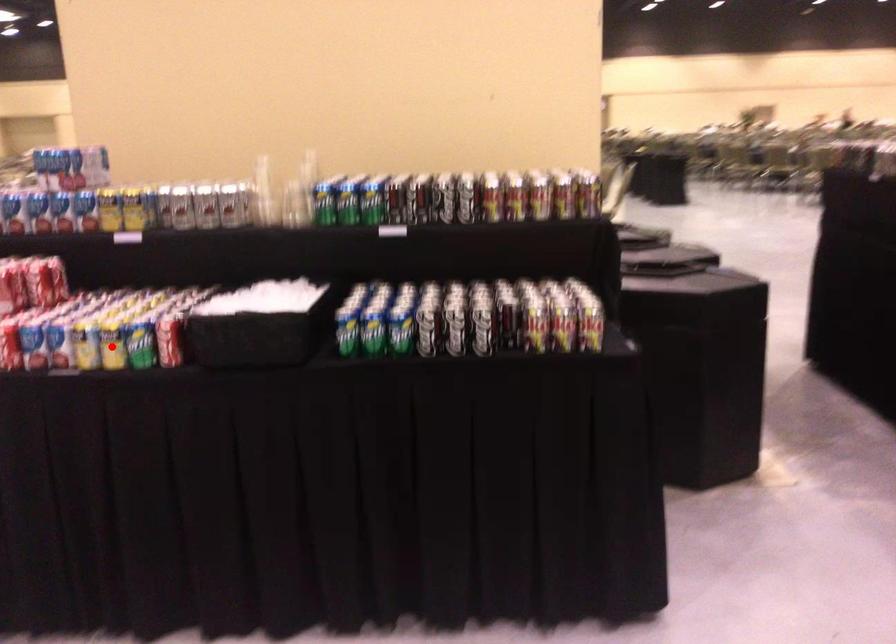
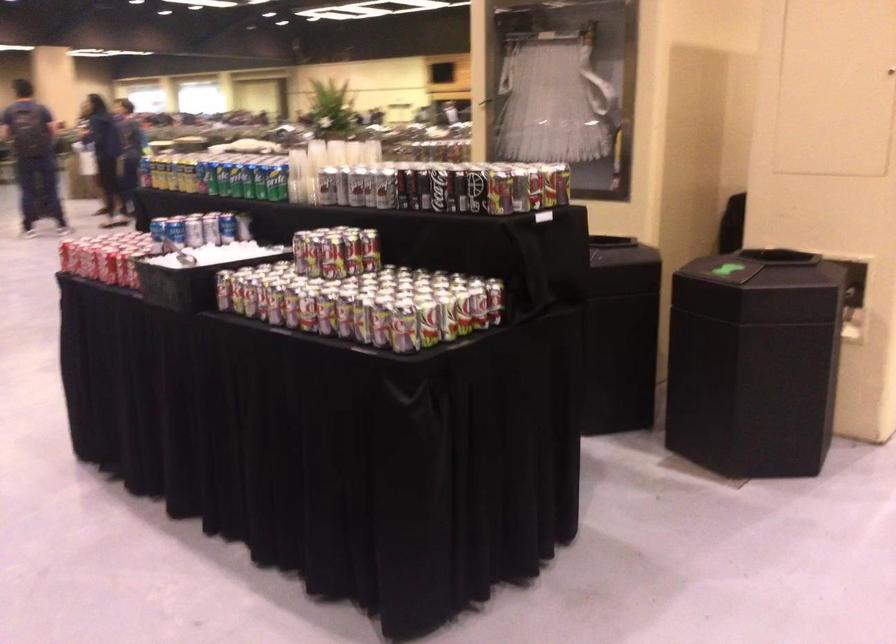
Question: I am providing you with two images of the same scene from different viewpoints. A red point is marked on the first image. Is the red point's position out of view in image 2?

Choices:
 (A) Yes
 (B) No

Answer: (A)